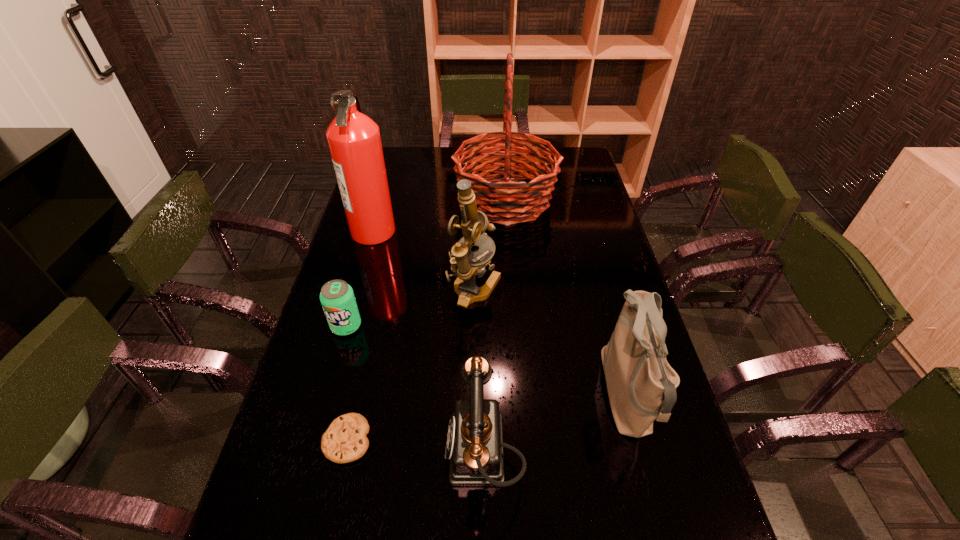
What are the coordinates of `basket` in the screenshot? It's located at (493, 196).

This screenshot has height=540, width=960. In order to click on fire extinguisher in this screenshot , I will do `click(354, 141)`.

This screenshot has height=540, width=960. Identify the location of microscope. (466, 265).

You are a GUI agent. You are given a task and a screenshot of the screen. Output one action in this format:
    pyautogui.click(x=<x>, y=<y>)
    Task: Click on the fifth nearest object
    
    Given the screenshot: What is the action you would take?
    (466, 265)

The width and height of the screenshot is (960, 540). I want to click on the fourth shortest object, so click(x=641, y=384).

Identify the location of the rightmost object. (641, 384).

Image resolution: width=960 pixels, height=540 pixels. I want to click on the fifth tallest object, so click(474, 444).

The height and width of the screenshot is (540, 960). I want to click on pop soda, so click(337, 298).

The height and width of the screenshot is (540, 960). I want to click on the fourth farthest object, so click(337, 298).

The image size is (960, 540). What are the coordinates of `cookie` in the screenshot? It's located at (345, 440).